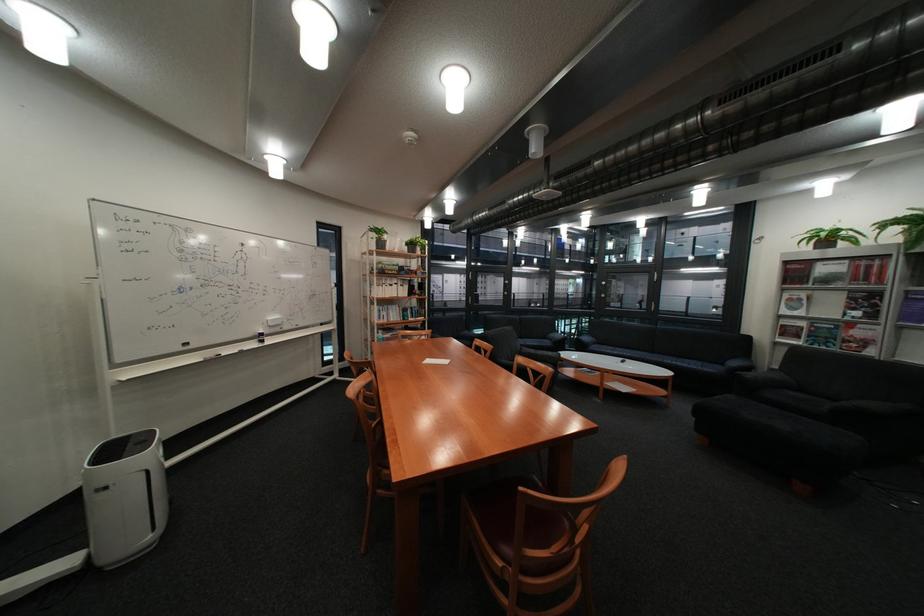
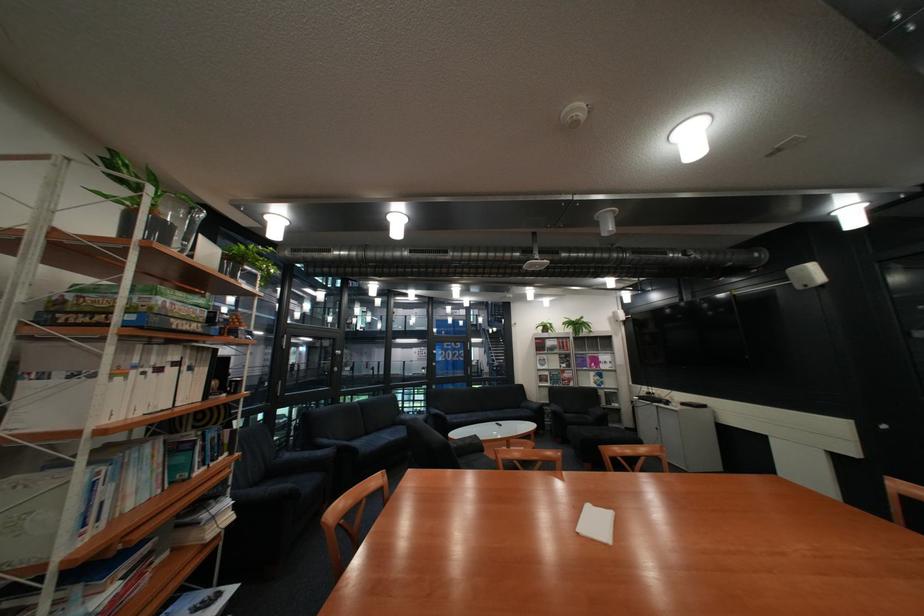
Find the pixel in the second image that matches point 408,307 in the first image.

(163, 448)